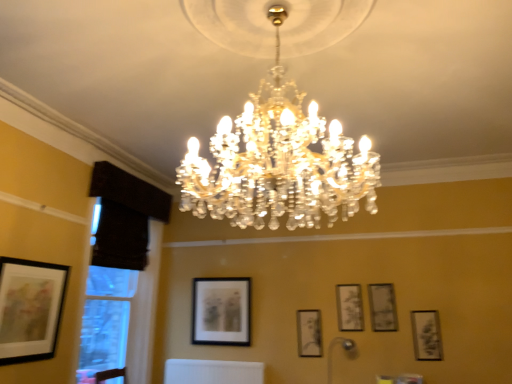
In the scene shown: How much space does metallic silver lamp at lower center, acting as the 1th lamp starting from the right, occupy horizontally?

metallic silver lamp at lower center, acting as the 1th lamp starting from the right, is 12.12 inches in width.

The image size is (512, 384). I want to click on matte black picture frame at center, which appears as the 2th picture frame when viewed from the back, so click(x=309, y=333).

This screenshot has width=512, height=384. What do you see at coordinates (349, 307) in the screenshot?
I see `black paper at center, positioned as the third picture frame in right-to-left order` at bounding box center [349, 307].

Find the location of a particular element. black fabric window at left is located at coordinates (105, 321).

Does black paper at center, the 3th picture frame viewed from the back, have a lesser width compared to metallic silver lamp at lower center, marked as the first lamp in a bottom-to-top arrangement?

Indeed, black paper at center, the 3th picture frame viewed from the back, has a lesser width compared to metallic silver lamp at lower center, marked as the first lamp in a bottom-to-top arrangement.

From a real-world perspective, is black paper at center, the 3th picture frame viewed from the back, above or below metallic silver lamp at lower center, marked as the first lamp in a bottom-to-top arrangement?

Clearly, from a real-world perspective, black paper at center, the 3th picture frame viewed from the back, is above metallic silver lamp at lower center, marked as the first lamp in a bottom-to-top arrangement.

Measure the distance between black paper at center, the 4th picture frame positioned from the left, and metallic silver lamp at lower center, acting as the 1th lamp starting from the right.

black paper at center, the 4th picture frame positioned from the left, is 11.79 inches away from metallic silver lamp at lower center, acting as the 1th lamp starting from the right.

Considering the relative positions of black paper at center, the 3th picture frame viewed from the back, and metallic silver lamp at lower center, marked as the first lamp in a bottom-to-top arrangement, in the image provided, is black paper at center, the 3th picture frame viewed from the back, behind metallic silver lamp at lower center, marked as the first lamp in a bottom-to-top arrangement,?

Yes, black paper at center, the 3th picture frame viewed from the back, is further from the viewer.

Does matte black picture frame at lower left, which is the sixth picture frame from right to left, touch black fabric window at left?

No, matte black picture frame at lower left, which is the sixth picture frame from right to left, is not in contact with black fabric window at left.

Based on the photo, relative to black fabric window at left, is matte black picture frame at lower left, which is the 6th picture frame in back-to-front order, in front or behind?

Clearly, matte black picture frame at lower left, which is the 6th picture frame in back-to-front order, is in front of black fabric window at left.

Which of these two, matte black picture frame at lower left, which is the sixth picture frame from right to left, or black fabric window at left, is bigger?

Bigger between the two is black fabric window at left.

How different are the orientations of matte black picture frame at lower left, which is the 6th picture frame in back-to-front order, and black fabric window at left in degrees?

There is a 0.633-degree angle between the facing directions of matte black picture frame at lower left, which is the 6th picture frame in back-to-front order, and black fabric window at left.

Is point (298, 328) closer or farther from the camera than point (222, 27)?

Point (298, 328) is farther from the camera than point (222, 27).

Considering the sizes of objects matte black picture frame at center, the fourth picture frame in the right-to-left sequence, and clear crystal chandelier at center, the second lamp in the bottom-to-top sequence, in the image provided, who is thinner, matte black picture frame at center, the fourth picture frame in the right-to-left sequence, or clear crystal chandelier at center, the second lamp in the bottom-to-top sequence,?

→ Thinner between the two is matte black picture frame at center, the fourth picture frame in the right-to-left sequence.

How much distance is there between matte black picture frame at center, the fourth picture frame in the right-to-left sequence, and clear crystal chandelier at center, the second lamp in the bottom-to-top sequence?

They are 9.51 feet apart.

Consider the image. Is matte black picture frame at center, the 5th picture frame positioned from the front, oriented towards clear crystal chandelier at center, the first lamp in the top-to-bottom sequence?

Yes, matte black picture frame at center, the 5th picture frame positioned from the front, is turned towards clear crystal chandelier at center, the first lamp in the top-to-bottom sequence.

Could you tell me if matte black picture frame at upper right, which appears as the fifth picture frame when viewed from the back, is facing matte black picture frame at center, the fifth picture frame in the right-to-left sequence?

No.

How distant is matte black picture frame at upper right, which is counted as the 1th picture frame, starting from the right, from matte black picture frame at center, the 1th picture frame in the back-to-front sequence?

matte black picture frame at upper right, which is counted as the 1th picture frame, starting from the right, and matte black picture frame at center, the 1th picture frame in the back-to-front sequence, are 2.05 meters apart from each other.

Between point (428, 347) and point (225, 338), which one is positioned in front?

The point (428, 347) is in front.

Is matte black picture frame at upper right, marked as the 2th picture frame in a front-to-back arrangement, wider or thinner than matte black picture frame at center, the fifth picture frame in the right-to-left sequence?

In the image, matte black picture frame at upper right, marked as the 2th picture frame in a front-to-back arrangement, appears to be more narrow than matte black picture frame at center, the fifth picture frame in the right-to-left sequence.

You are a GUI agent. You are given a task and a screenshot of the screen. Output one action in this format:
    pyautogui.click(x=<x>, y=<y>)
    Task: Click on the lamp behind the clear crystal chandelier at center, which ranks as the 1th lamp in left-to-right order
    The height and width of the screenshot is (384, 512).
    Given the screenshot: What is the action you would take?
    pyautogui.click(x=343, y=348)

Is clear crystal chandelier at center, the second lamp in the bottom-to-top sequence, in front of or behind metallic silver lamp at lower center, which is counted as the first lamp, starting from the back, in the image?

clear crystal chandelier at center, the second lamp in the bottom-to-top sequence, is positioned closer to the viewer than metallic silver lamp at lower center, which is counted as the first lamp, starting from the back.

Would you say clear crystal chandelier at center, the second lamp in the bottom-to-top sequence, is to the left or to the right of metallic silver lamp at lower center, marked as the first lamp in a bottom-to-top arrangement, in the picture?

clear crystal chandelier at center, the second lamp in the bottom-to-top sequence, is positioned on metallic silver lamp at lower center, marked as the first lamp in a bottom-to-top arrangement,'s left side.

Who is shorter, clear crystal chandelier at center, the second lamp in the bottom-to-top sequence, or metallic silver lamp at lower center, which is counted as the first lamp, starting from the back?

metallic silver lamp at lower center, which is counted as the first lamp, starting from the back, is shorter.

Does point (10, 308) appear closer or farther from the camera than point (319, 336)?

Point (10, 308) is closer to the camera than point (319, 336).

Is matte black picture frame at lower left, arranged as the 1th picture frame when viewed from the left, oriented towards matte black picture frame at center, the 3th picture frame viewed from the left?

No, matte black picture frame at lower left, arranged as the 1th picture frame when viewed from the left, is not aimed at matte black picture frame at center, the 3th picture frame viewed from the left.

How much distance is there between matte black picture frame at lower left, which is the sixth picture frame from right to left, and matte black picture frame at center, the fourth picture frame in the right-to-left sequence?

The distance of matte black picture frame at lower left, which is the sixth picture frame from right to left, from matte black picture frame at center, the fourth picture frame in the right-to-left sequence, is 8.76 feet.

From a real-world perspective, is matte black picture frame at lower left, the 1th picture frame positioned from the front, physically above matte black picture frame at center, which appears as the 2th picture frame when viewed from the back?

Yes, from a real-world perspective, matte black picture frame at lower left, the 1th picture frame positioned from the front, is on top of matte black picture frame at center, which appears as the 2th picture frame when viewed from the back.

This screenshot has height=384, width=512. I want to click on the 2nd picture frame positioned below the clear crystal chandelier at center, the second lamp in the bottom-to-top sequence (from the image's perspective), so click(383, 307).

Visually, is clear crystal chandelier at center, positioned as the 1th lamp in front-to-back order, positioned to the left or to the right of matte black picture frame at upper right, arranged as the 5th picture frame when viewed from the left?

clear crystal chandelier at center, positioned as the 1th lamp in front-to-back order, is positioned on matte black picture frame at upper right, arranged as the 5th picture frame when viewed from the left,'s left side.

How far apart are clear crystal chandelier at center, the 2th lamp from the back, and matte black picture frame at upper right, the third picture frame from the front?

clear crystal chandelier at center, the 2th lamp from the back, is 9.18 feet away from matte black picture frame at upper right, the third picture frame from the front.

From the image's perspective, which one is positioned higher, clear crystal chandelier at center, the 2th lamp from the back, or matte black picture frame at upper right, the second picture frame from the right?

clear crystal chandelier at center, the 2th lamp from the back, from the image's perspective.

Image resolution: width=512 pixels, height=384 pixels. What are the coordinates of `lamp that is under the black paper at center, positioned as the 4th picture frame in front-to-back order (from a real-world perspective)` in the screenshot? It's located at (343, 348).

Find the location of a particular element. The image size is (512, 384). window located behind the matte black picture frame at lower left, which is the sixth picture frame from right to left is located at coordinates (105, 321).

Based on their spatial positions, is matte black picture frame at center, the second picture frame in the left-to-right sequence, or black paper at center, positioned as the third picture frame in right-to-left order, closer to matte black picture frame at center, which appears as the 2th picture frame when viewed from the back?

The object closer to matte black picture frame at center, which appears as the 2th picture frame when viewed from the back, is black paper at center, positioned as the third picture frame in right-to-left order.

When comparing their distances from matte black picture frame at center, the 5th picture frame positioned from the front, does matte black picture frame at upper right, arranged as the 5th picture frame when viewed from the left, or metallic silver lamp at lower center, placed as the second lamp when sorted from front to back, seem closer?

metallic silver lamp at lower center, placed as the second lamp when sorted from front to back, is positioned closer to the anchor matte black picture frame at center, the 5th picture frame positioned from the front.

In the scene shown: Estimate the real-world distances between objects in this image. Which object is closer to metallic silver lamp at lower center, the 2th lamp from the left, black fabric window at left or matte black picture frame at upper right, the fourth picture frame when ordered from back to front?

matte black picture frame at upper right, the fourth picture frame when ordered from back to front, is positioned closer to the anchor metallic silver lamp at lower center, the 2th lamp from the left.

From the image, which object appears to be farther from black paper at center, the 3th picture frame viewed from the back, metallic silver lamp at lower center, the 2th lamp from the left, or matte black picture frame at upper right, the second picture frame from the right?

metallic silver lamp at lower center, the 2th lamp from the left.

Based on their spatial positions, is metallic silver lamp at lower center, marked as the first lamp in a bottom-to-top arrangement, or matte black picture frame at center, the second picture frame in the left-to-right sequence, closer to matte black picture frame at lower left, the 1th picture frame positioned from the front?

Based on the image, matte black picture frame at center, the second picture frame in the left-to-right sequence, appears to be nearer to matte black picture frame at lower left, the 1th picture frame positioned from the front.

Based on their spatial positions, is matte black picture frame at upper right, the second picture frame from the right, or matte black picture frame at center, the fifth picture frame in the right-to-left sequence, closer to matte black picture frame at upper right, arranged as the 6th picture frame when viewed from the left?

Among the two, matte black picture frame at upper right, the second picture frame from the right, is located nearer to matte black picture frame at upper right, arranged as the 6th picture frame when viewed from the left.

From the image, which object appears to be nearer to clear crystal chandelier at center, which is counted as the second lamp, starting from the right, matte black picture frame at center, the 3th picture frame viewed from the left, or matte black picture frame at lower left, which is the 6th picture frame in back-to-front order?

matte black picture frame at lower left, which is the 6th picture frame in back-to-front order, lies closer to clear crystal chandelier at center, which is counted as the second lamp, starting from the right, than the other object.

Which object lies nearer to the anchor point clear crystal chandelier at center, the first lamp in the top-to-bottom sequence, matte black picture frame at upper right, marked as the 2th picture frame in a front-to-back arrangement, or matte black picture frame at center, the fourth picture frame in the right-to-left sequence?

matte black picture frame at center, the fourth picture frame in the right-to-left sequence, is closer to clear crystal chandelier at center, the first lamp in the top-to-bottom sequence.

Where is `picture frame between matte black picture frame at center, the sixth picture frame viewed from the front, and black paper at center, the 3th picture frame viewed from the back, in the horizontal direction`? picture frame between matte black picture frame at center, the sixth picture frame viewed from the front, and black paper at center, the 3th picture frame viewed from the back, in the horizontal direction is located at coordinates (309, 333).

This screenshot has height=384, width=512. I want to click on picture frame located between matte black picture frame at lower left, arranged as the 1th picture frame when viewed from the left, and matte black picture frame at center, the fourth picture frame in the right-to-left sequence, in the left-right direction, so click(221, 311).

I want to click on picture frame located between matte black picture frame at center, the 1th picture frame in the back-to-front sequence, and metallic silver lamp at lower center, acting as the 1th lamp starting from the right, in the left-right direction, so click(309, 333).

In order to click on lamp between clear crystal chandelier at center, which is counted as the second lamp, starting from the right, and matte black picture frame at upper right, arranged as the 5th picture frame when viewed from the left, along the z-axis in this screenshot , I will do `click(343, 348)`.